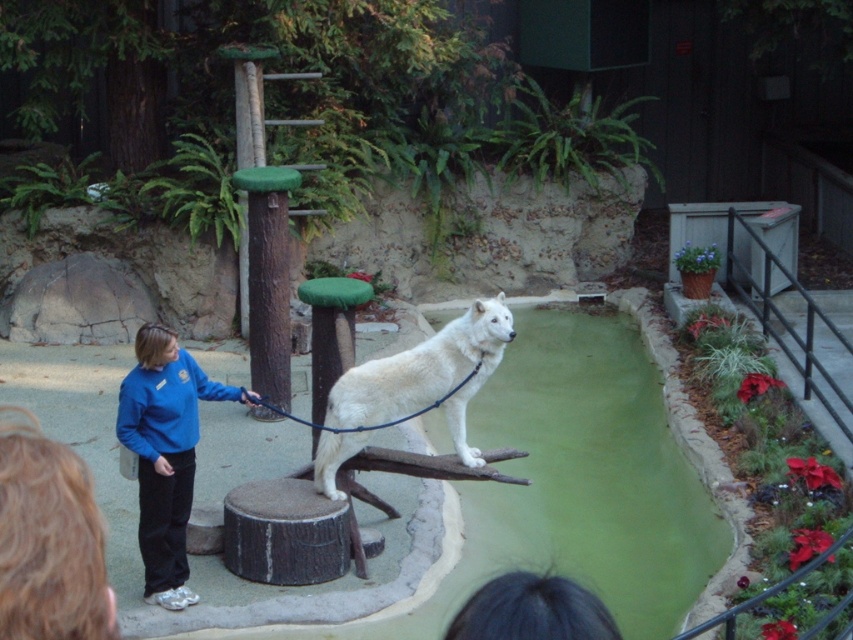
Who is higher up, blue fleece jacket at center or white fur dog at center?

white fur dog at center is above.

Can you confirm if blue fleece jacket at center is shorter than white fur dog at center?

No, blue fleece jacket at center is not shorter than white fur dog at center.

Who is more distant from viewer, (144, 422) or (448, 426)?

The point (448, 426) is behind.

Where is `blue fleece jacket at center`? The image size is (853, 640). blue fleece jacket at center is located at coordinates (165, 452).